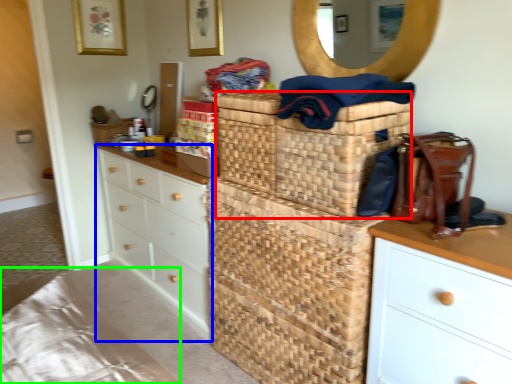
Question: Estimate the real-world distances between objects in this image. Which object is farther from basket (highlighted by a red box), chest of drawers (highlighted by a blue box) or bedding (highlighted by a green box)?

Choices:
 (A) chest of drawers
 (B) bedding

Answer: (B)